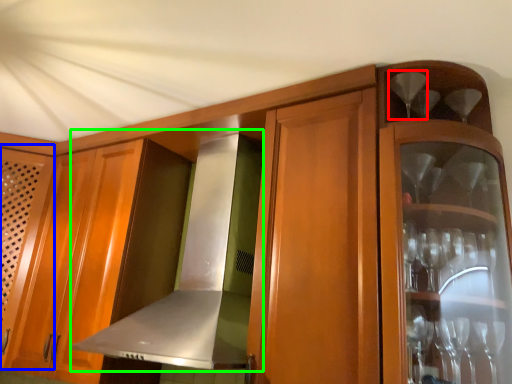
Question: Estimate the real-world distances between objects in this image. Which object is farther from wine glass (highlighted by a red box), door (highlighted by a blue box) or exhaust hood (highlighted by a green box)?

Choices:
 (A) door
 (B) exhaust hood

Answer: (A)